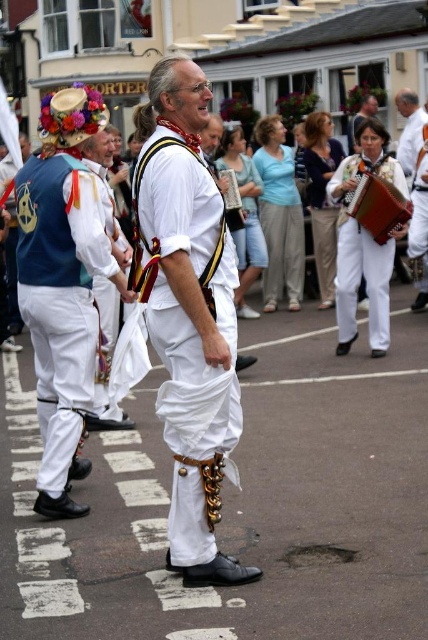
You are a costume designer preparing for a parade. You have two items from the image to place on a display stand. The white matte pants at center and the white cotton accordion at center. Given their sizes, which item will require a wider display stand base to support it?

The white matte pants at center requires a wider display stand base because its width is larger than the white cotton accordion at center.

You are a photographer trying to capture the central figure in the street scene. Since the white matte pants at center and the matte blue vest at center are both in your view, which one is closer to you?

The white matte pants at center is in front of the matte blue vest at center, so the white matte pants at center is closer to you.

You are a photographer trying to capture the central figure in the lively street scene. Since the matte blue vest at center and the white cotton accordion at center are both in your view, which object is closer to you?

The matte blue vest at center is in front of the white cotton accordion at center, so the matte blue vest at center is closer to you.